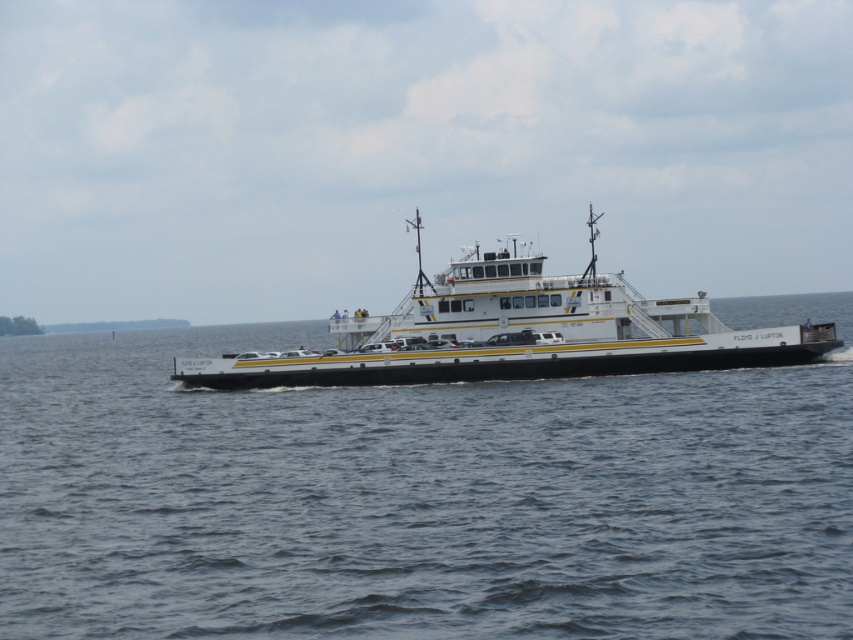
In the scene shown: Does black water at center appear on the right side of white/yellow painted ferry at center?

No, black water at center is not to the right of white/yellow painted ferry at center.

Who is more forward, (x=693, y=616) or (x=428, y=371)?

Point (x=693, y=616) is in front.

Is point (0, 435) farther from viewer compared to point (555, 285)?

No, it is not.

Locate an element on the screen. The width and height of the screenshot is (853, 640). black water at center is located at coordinates (422, 497).